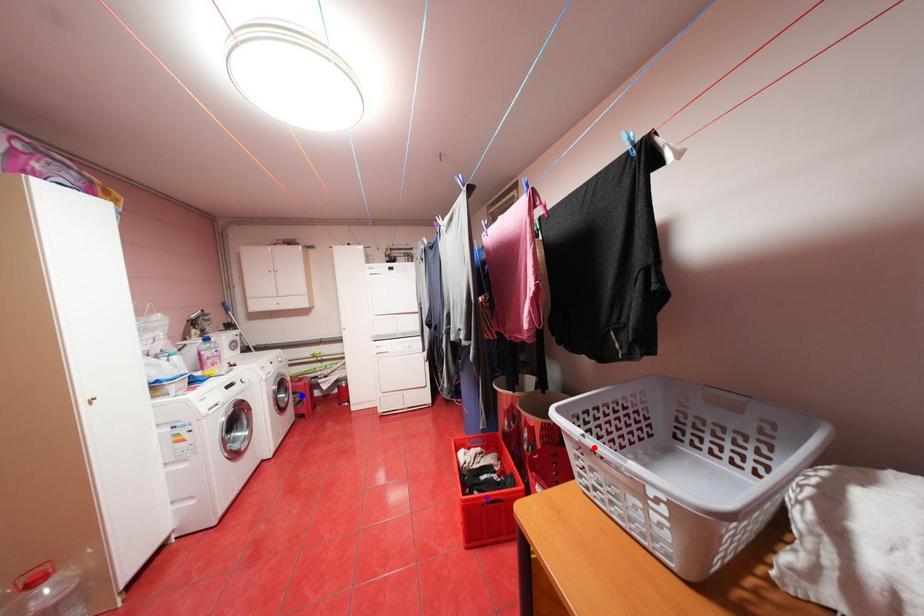
Order these from nearest to farthest:
A) purple point
B) blue point
C) red point

red point
purple point
blue point